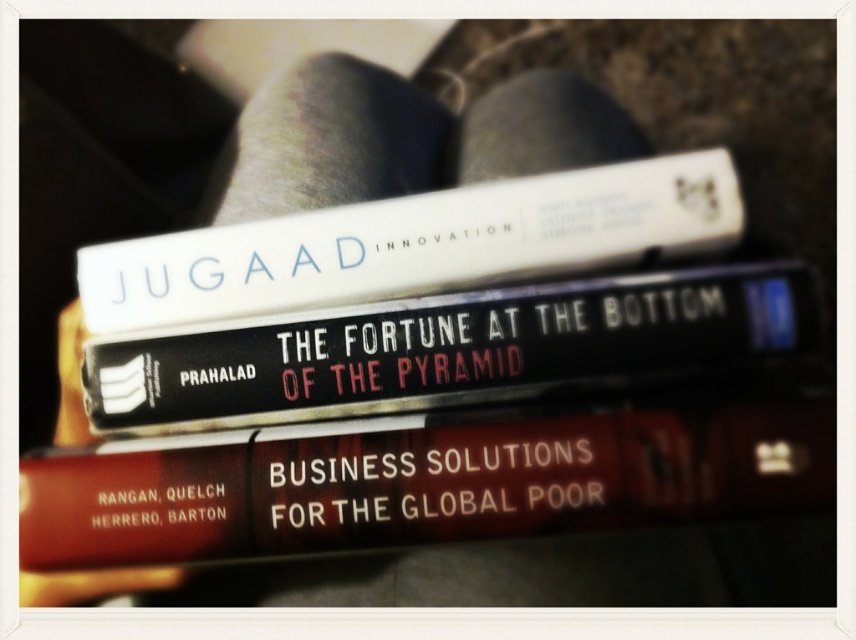
Who is taller, red matte book at center or white matte book at upper center?

With more height is white matte book at upper center.

Can you confirm if red matte book at center is positioned to the right of white matte book at upper center?

Correct, you'll find red matte book at center to the right of white matte book at upper center.

Find the location of a particular element. The width and height of the screenshot is (856, 640). red matte book at center is located at coordinates (420, 483).

In the scene shown: Can you confirm if black matte book at center is shorter than white matte book at upper center?

Yes.

Consider the image. Is black matte book at center smaller than white matte book at upper center?

No, black matte book at center is not smaller than white matte book at upper center.

Identify the location of black matte book at center. (450, 349).

I want to click on black matte book at center, so click(450, 349).

Is point (360, 481) positioned before point (557, 317)?

Yes, it is.

In the scene shown: Can you confirm if red matte book at center is shorter than black matte book at center?

Indeed, red matte book at center has a lesser height compared to black matte book at center.

What are the coordinates of `red matte book at center` in the screenshot? It's located at (420, 483).